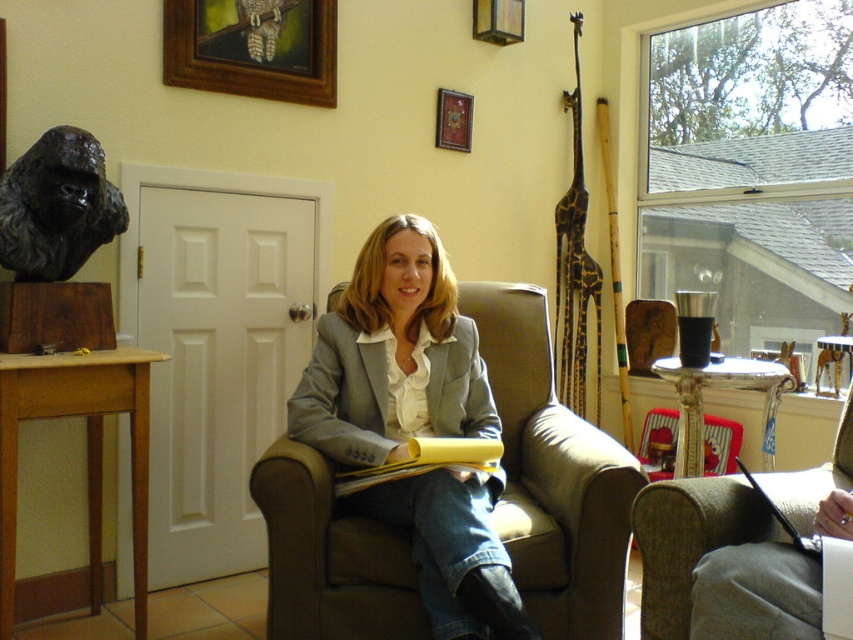
You are an interior designer planning to hang a new artwork. You see the black bronze gorilla head at left and the wooden picture frame at upper center. Which object is positioned lower in the room?

The black bronze gorilla head at left is positioned lower in the room than the wooden picture frame at upper center.

You are an interior designer assessing the placement of items in the living room. Considering the height of the black bronze gorilla head at left and the wooden picture frame at upper center, which one would require a higher shelf to accommodate its size?

The black bronze gorilla head at left is taller than the wooden picture frame at upper center, so it would require a higher shelf to accommodate its size.